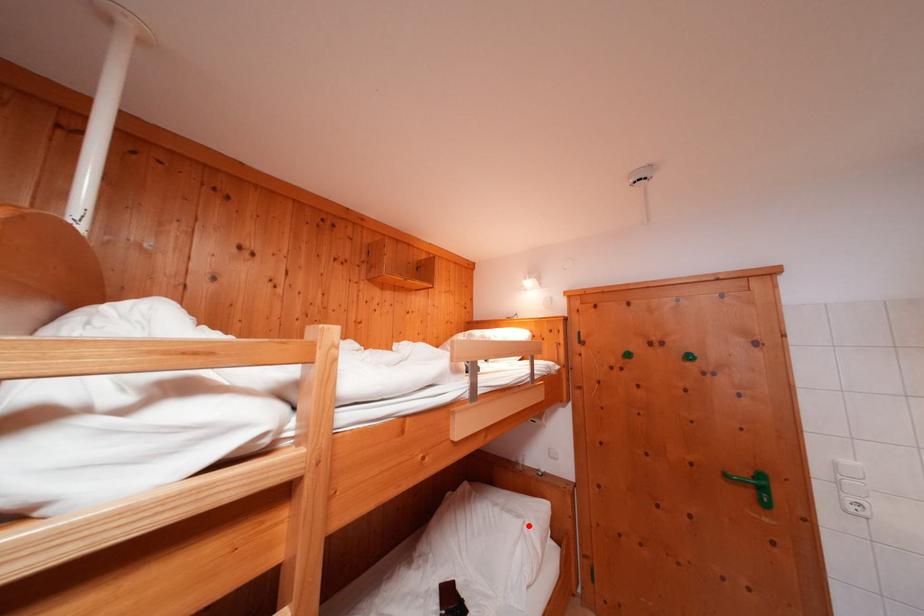
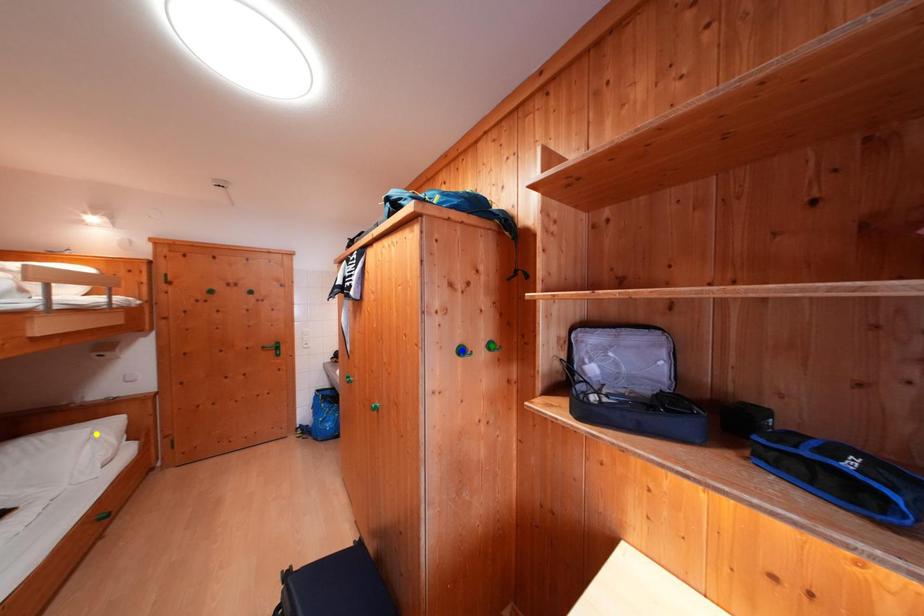
Question: I am providing you with two images of the same scene from different viewpoints. A red point is marked on the first image. You are given multiple points on the second image. Which point in image 2 is actually the same real-world point as the red point in image 1?

Choices:
 (A) yellow point
 (B) green point
 (C) blue point

Answer: (A)